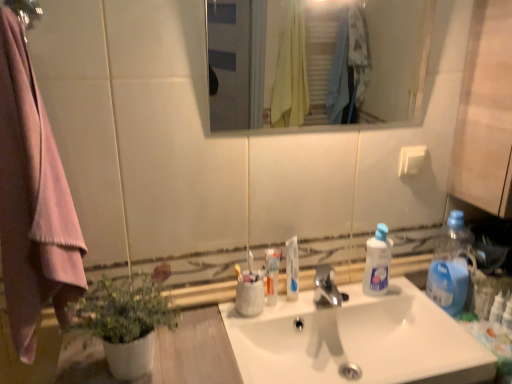
The image size is (512, 384). What are the coordinates of `vacant space to the left of transparent plastic bottle at sink, which is the second bottle in right-to-left order` in the screenshot? It's located at (340, 302).